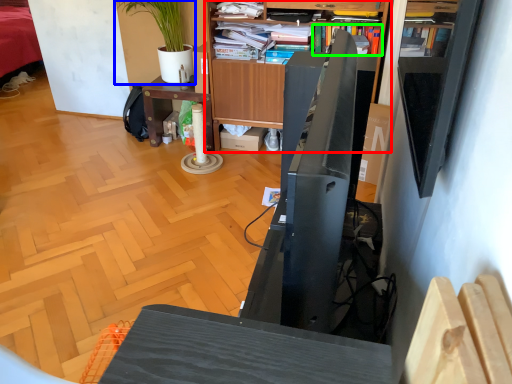
Question: Which is farther away from bookcase (highlighted by a red box)? houseplant (highlighted by a blue box) or book (highlighted by a green box)?

Choices:
 (A) houseplant
 (B) book

Answer: (A)